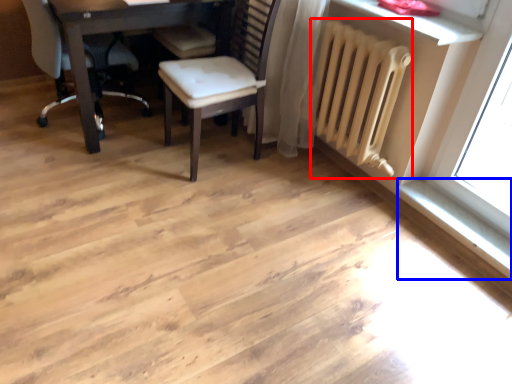
Question: Which of the following is the closest to the observer, radiator (highlighted by a red box) or window sill (highlighted by a blue box)?

Choices:
 (A) radiator
 (B) window sill

Answer: (A)